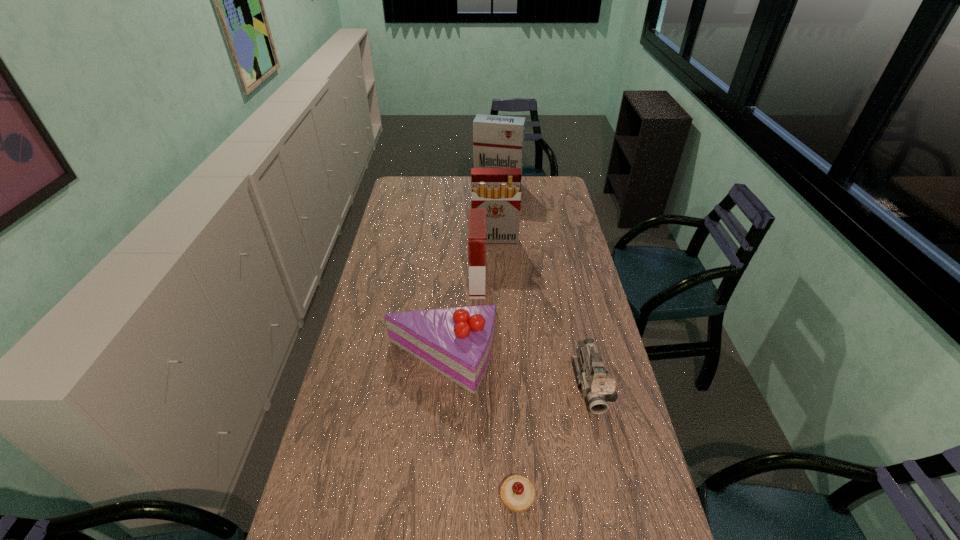
Locate an element on the screen. The image size is (960, 540). free region located on the front-facing side of the third farthest object is located at coordinates (570, 283).

You are a GUI agent. You are given a task and a screenshot of the screen. Output one action in this format:
    pyautogui.click(x=<x>, y=<y>)
    Task: Click on the free space located 0.120m on the back of the fourth tallest object
    
    Given the screenshot: What is the action you would take?
    pyautogui.click(x=445, y=307)

Find the location of a particular element. The width and height of the screenshot is (960, 540). vacant space situated 0.160m on the front-facing side of the second shortest object is located at coordinates (611, 470).

Where is `vacant space located on the left of the nearest object`? The width and height of the screenshot is (960, 540). vacant space located on the left of the nearest object is located at coordinates (414, 497).

You are a GUI agent. You are given a task and a screenshot of the screen. Output one action in this format:
    pyautogui.click(x=<x>, y=<y>)
    Task: Click on the object situated at the far edge
    
    Given the screenshot: What is the action you would take?
    pyautogui.click(x=498, y=141)

You are a GUI agent. You are given a task and a screenshot of the screen. Output one action in this format:
    pyautogui.click(x=<x>, y=<y>)
    Task: Click on the object present at the left edge
    
    Given the screenshot: What is the action you would take?
    pyautogui.click(x=458, y=342)

Locate an element on the screen. This screenshot has height=540, width=960. object situated at the right edge is located at coordinates (596, 383).

You are a GUI agent. You are given a task and a screenshot of the screen. Output one action in this format:
    pyautogui.click(x=<x>, y=<y>)
    Task: Click on the free space at the left edge of the desktop
    Image resolution: width=960 pixels, height=540 pixels.
    Given the screenshot: What is the action you would take?
    pyautogui.click(x=402, y=300)

This screenshot has width=960, height=540. I want to click on vacant space at the right edge of the desktop, so click(x=561, y=204).

Identify the location of vacant space at the far left corner of the desktop. This screenshot has width=960, height=540. (400, 188).